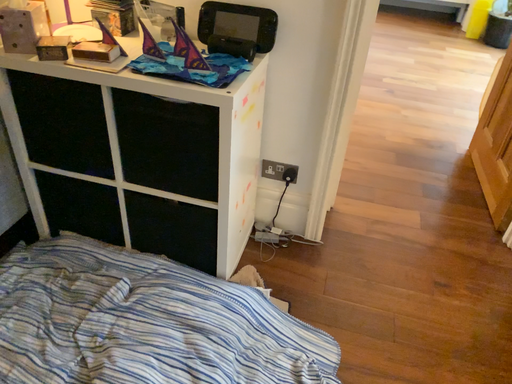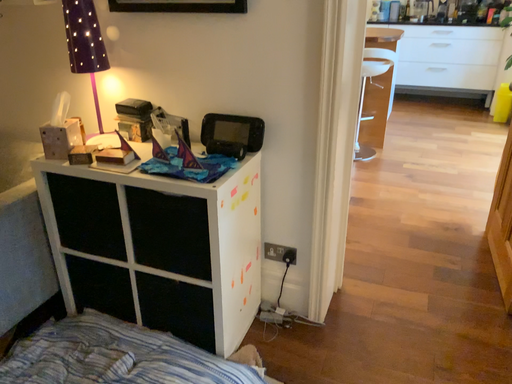
Question: Which way did the camera rotate in the video?

Choices:
 (A) rotated right
 (B) rotated left

Answer: (B)